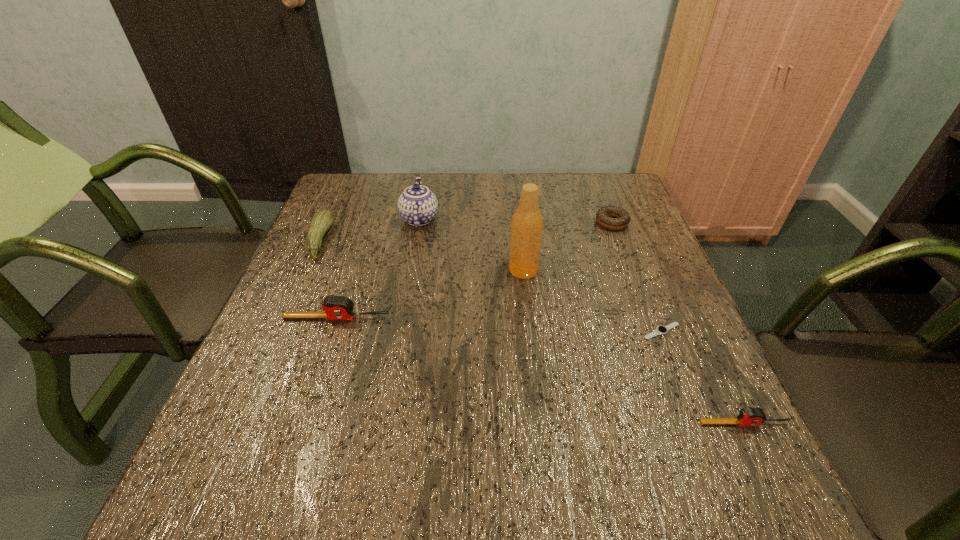
Where is `vacant spot for a new tape_measure to ensure equal spacing`? This screenshot has width=960, height=540. vacant spot for a new tape_measure to ensure equal spacing is located at coordinates (518, 365).